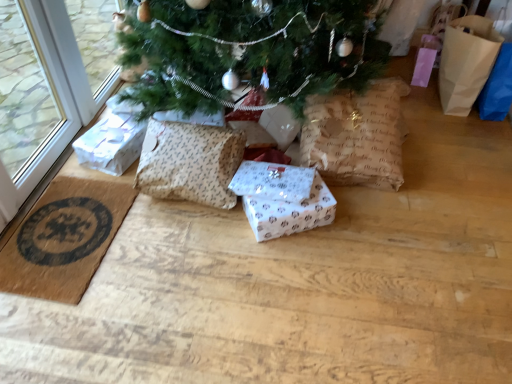
Question: Is point (314, 215) closer or farther from the camera than point (494, 29)?

Choices:
 (A) closer
 (B) farther

Answer: (A)

Question: Looking at their shapes, would you say white paper gift box at center, the 3th gift box viewed from the left, is wider or thinner than brown paper bag at right?

Choices:
 (A) thin
 (B) wide

Answer: (A)

Question: Estimate the real-world distances between objects in this image. Which object is closer to the white paper gift at left, arranged as the third gift box when viewed from the right?

Choices:
 (A) white paper gift at center, which appears as the second gift box when viewed from the left
 (B) brown paper bag at center
 (C) brown paper bag at right
 (D) white paper gift box at center, which is the 1th gift box from right to left
 (E) patterned fabric pillow at center

Answer: (E)

Question: Based on their relative distances, which object is farther from the white paper gift at center, arranged as the 2th gift box when viewed from the right?

Choices:
 (A) brown woven mat at lower left
 (B) white paper gift box at center, which is the 1th gift box from right to left
 (C) patterned fabric pillow at center
 (D) brown paper bag at right
 (E) white paper gift at left, placed as the 1th gift box when sorted from left to right

Answer: (D)